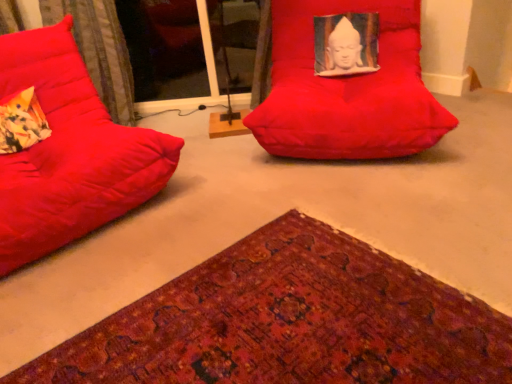
The image size is (512, 384). Identify the location of free spot behind textured woolen mat at lower left. (258, 195).